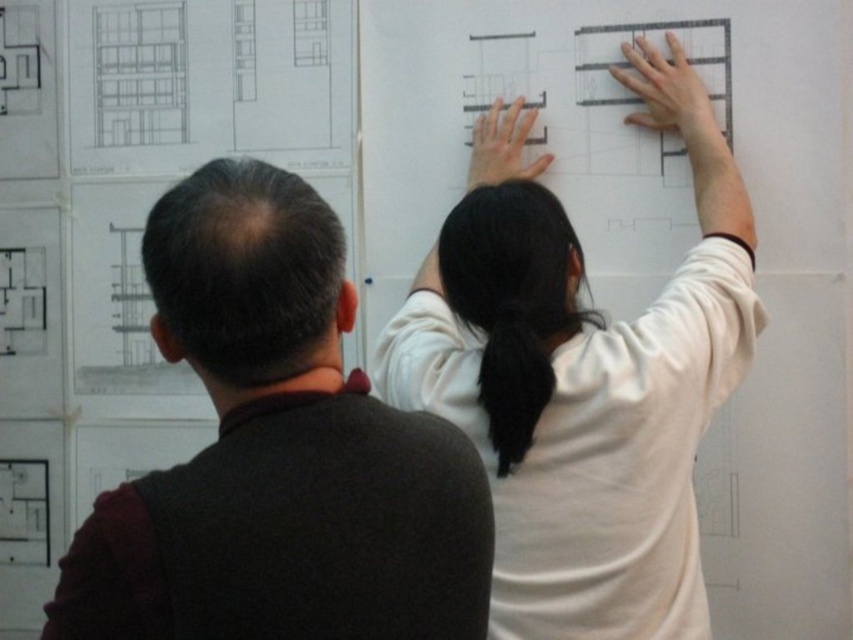
Question: Does dark brown sweater at left appear on the right side of white matte shirt at upper center?

Choices:
 (A) yes
 (B) no

Answer: (B)

Question: Among these points, which one is nearest to the camera?

Choices:
 (A) (450, 228)
 (B) (215, 336)

Answer: (B)

Question: Is dark brown sweater at left wider than white matte shirt at upper center?

Choices:
 (A) yes
 (B) no

Answer: (B)

Question: Does dark brown sweater at left have a larger size compared to white matte shirt at upper center?

Choices:
 (A) yes
 (B) no

Answer: (B)

Question: Which of the following is the farthest from the observer?

Choices:
 (A) dark brown sweater at left
 (B) white matte shirt at upper center

Answer: (B)

Question: Which of the following is the farthest from the observer?

Choices:
 (A) (309, 401)
 (B) (682, 534)

Answer: (B)